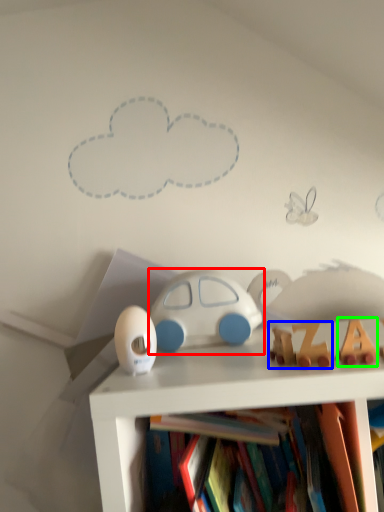
Question: Considering the real-world distances, which object is farthest from toy (highlighted by a red box)? toy (highlighted by a blue box) or toy (highlighted by a green box)?

Choices:
 (A) toy
 (B) toy

Answer: (B)